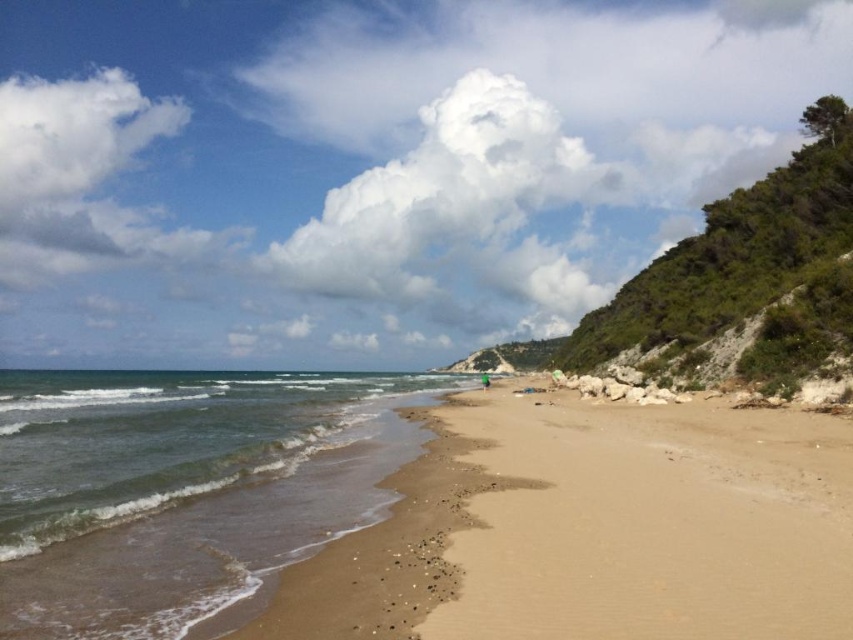
You are standing at the point marked as point (181, 486) on the beach. Looking around, you see the greenish blue water at lower left. What direction should you walk to reach the greenish blue water at lower left?

Since you are already at the point where the greenish blue water at lower left is located, you are already at the greenish blue water at lower left.

You are standing on the beach in the image and want to walk from the point at coordinates point [310,540] to the point at coordinates point [485,371]. Which direction should you face to walk directly towards your destination?

You should face towards the point at coordinates point [485,371], which is behind the starting point at point [310,540]. Since point [310,540] is in front of point [485,371], you need to walk in the direction away from the hillside towards the ocean to reach your destination.